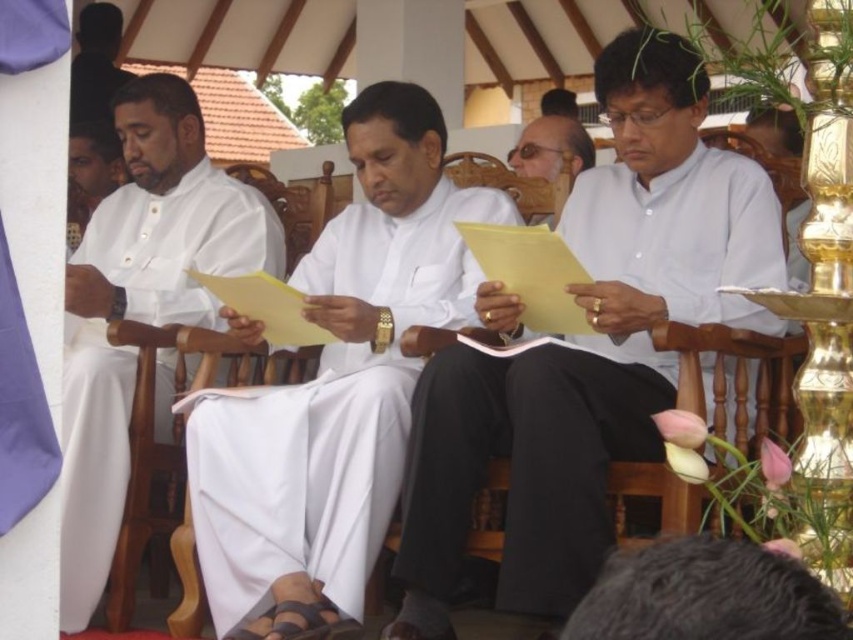
You are an event photographer at the ceremony. You need to capture a photo where both the white cloth at center and the matte white paper at center are clearly visible. Based on their positions, which object should you ensure is placed to the left in your camera frame?

The white cloth at center is positioned on the left side of matte white paper at center, so to ensure both are visible, the white cloth at center should be placed to the left in the camera frame.

You are a photographer positioned at the back of the pavilion. You want to take a photo of the white clothed man at left and the wooden chair at center. However, there is a tall potted plant blocking your view. Can you still capture both subjects in the same frame without moving the plant?

The white clothed man at left is in front of the wooden chair at center, so the man would block the view of the chair. Since the plant is already blocking your view, you cannot capture both subjects in the same frame without moving the plant.

You are a photographer at the event and need to capture a photo of both the white clothed man at left and the wooden chair at center. Based on their sizes, which one will appear larger in the photo?

The wooden chair at center will appear larger in the photo because the white clothed man at left is smaller than the wooden chair at center according to the description.